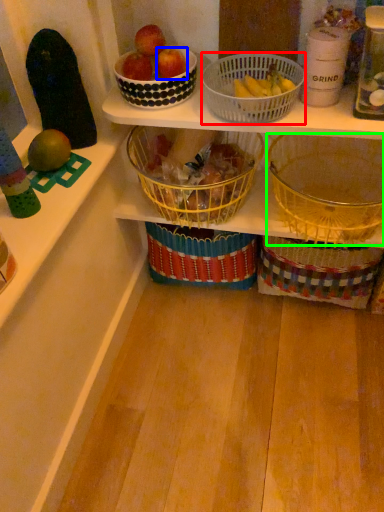
Question: Considering the real-world distances, which object is farthest from basket (highlighted by a red box)? apple (highlighted by a blue box) or basket (highlighted by a green box)?

Choices:
 (A) apple
 (B) basket

Answer: (B)